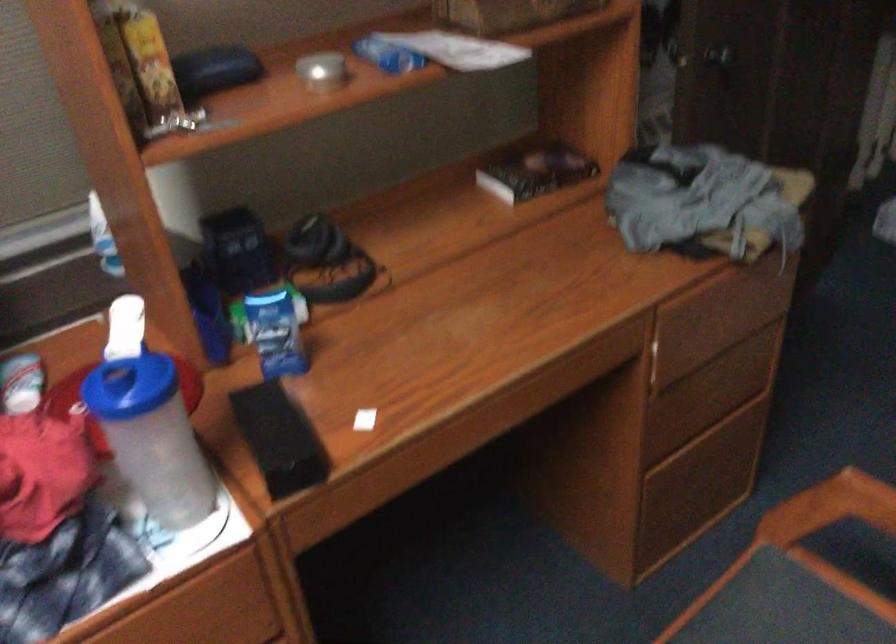
What do you see at coordinates (718, 55) in the screenshot? Image resolution: width=896 pixels, height=644 pixels. I see `a door handle` at bounding box center [718, 55].